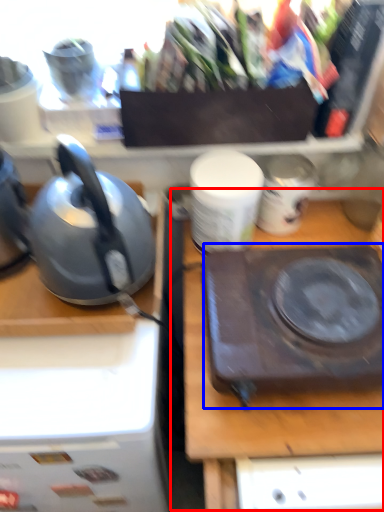
Question: Which object appears closest to the camera in this image, table (highlighted by a red box) or kitchen appliance (highlighted by a blue box)?

Choices:
 (A) table
 (B) kitchen appliance

Answer: (B)